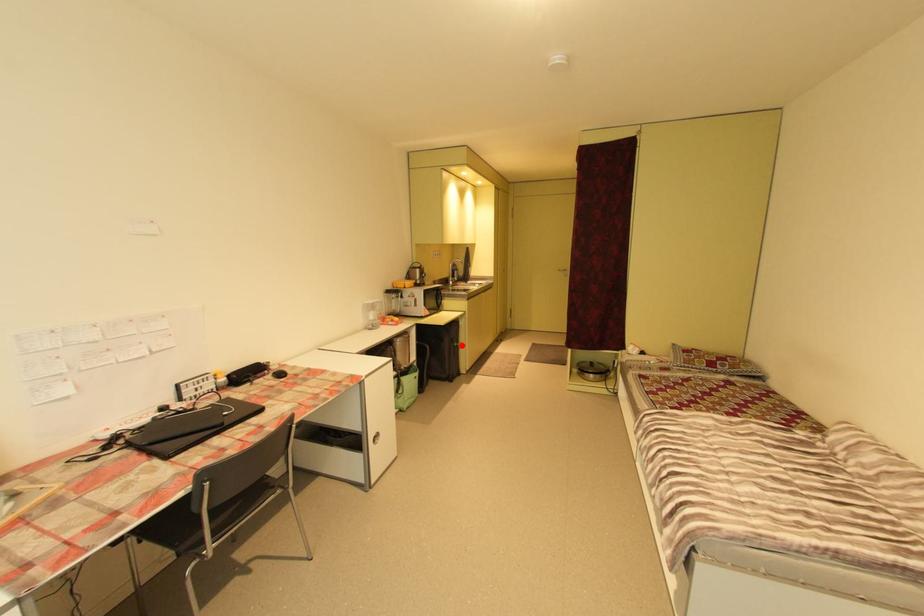
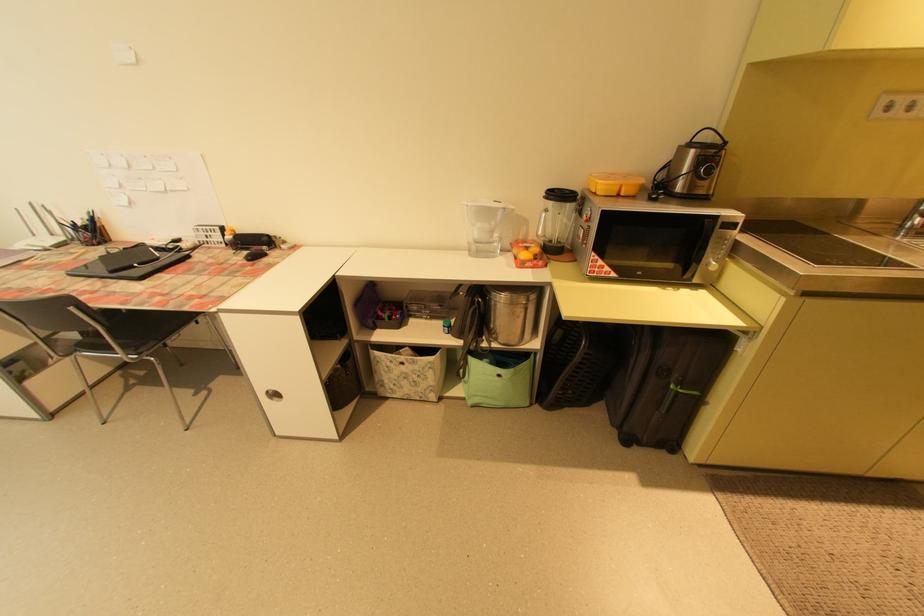
Where in the second image is the point corresponding to the highlighted location from the first image?

(678, 387)